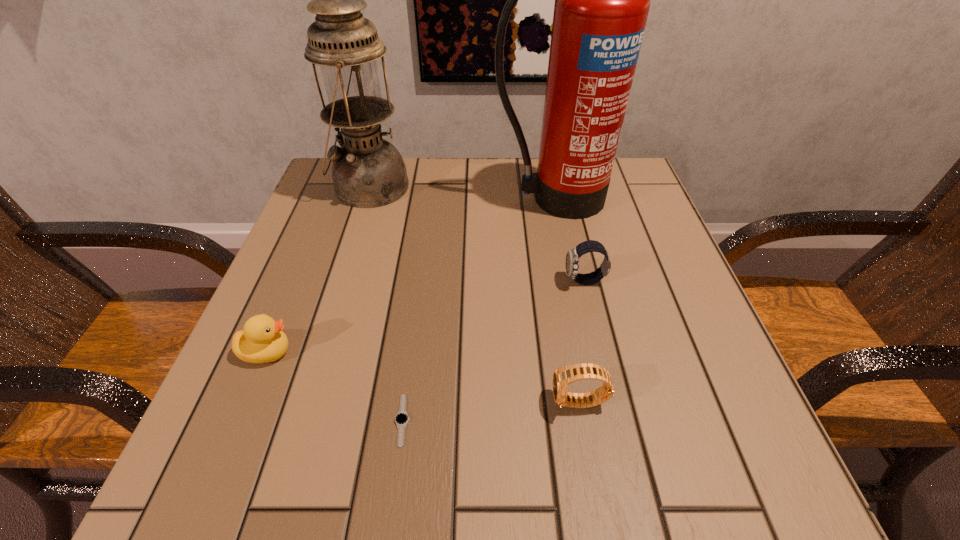
Locate an element on the screen. vacant space located on the face of the third farthest object is located at coordinates (438, 281).

This screenshot has width=960, height=540. I want to click on vacant space located on the face of the third nearest object, so click(324, 352).

You are a GUI agent. You are given a task and a screenshot of the screen. Output one action in this format:
    pyautogui.click(x=<x>, y=<y>)
    Task: Click on the vacant area situated on the left of the shortest object
    Image resolution: width=960 pixels, height=540 pixels.
    Given the screenshot: What is the action you would take?
    pyautogui.click(x=319, y=420)

Image resolution: width=960 pixels, height=540 pixels. In order to click on fire extinguisher located at the far edge in this screenshot , I will do `click(602, 0)`.

The image size is (960, 540). I want to click on oil lamp located in the far edge section of the desktop, so click(x=368, y=172).

Where is `object that is positioned at the near edge`? object that is positioned at the near edge is located at coordinates (401, 419).

Image resolution: width=960 pixels, height=540 pixels. I want to click on oil lamp situated at the left edge, so click(x=368, y=172).

Find the location of a particular element. duckling present at the left edge is located at coordinates (262, 340).

The height and width of the screenshot is (540, 960). In order to click on fire extinguisher positioned at the right edge in this screenshot , I will do `click(602, 0)`.

Where is `watch situated at the right edge`? This screenshot has width=960, height=540. watch situated at the right edge is located at coordinates (572, 258).